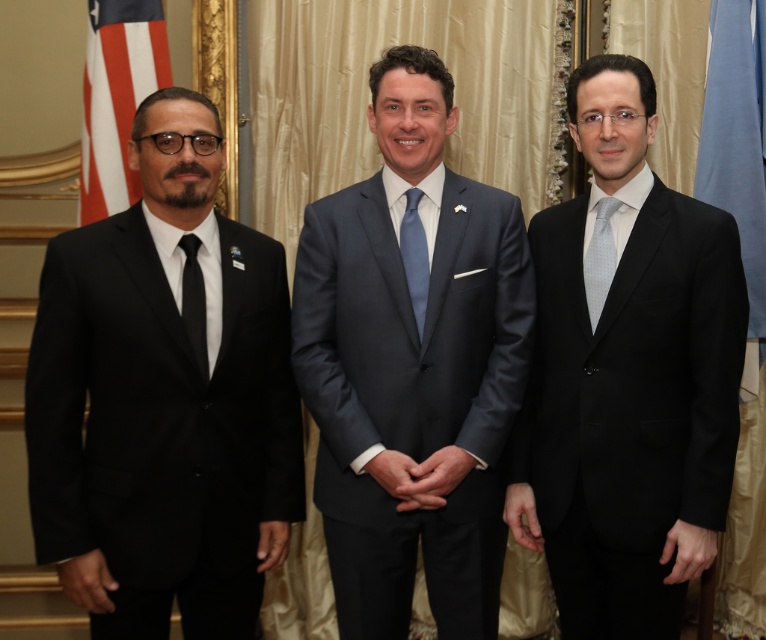
You are a photographer at a diplomatic event. You need to capture a photo where the blue fabric flag at right and the light blue dotted tie at center are exactly 30 inches apart in the frame. Can you position the camera so that their distance in the photo meets this requirement?

The blue fabric flag at right and light blue dotted tie at center are 31.42 inches apart in reality. Since the desired distance in the photo is 30 inches, which is slightly shorter than the actual distance, you can adjust the camera angle or zoom to compress the space between them, making their separation appear closer to the required 30 inches in the frame.

You are standing in front of the three men and want to determine which of the two points, point (755, 216) or point (129, 72), is closer to you. Based on the image, which point is nearer?

Point (755, 216) is closer to the viewer than point (129, 72).

You are attending a diplomatic event and notice two flags displayed behind the men. The flags are the blue fabric flag at right and the american flag at left. Based on their positions and sizes, which flag is narrower?

The blue fabric flag at right has a lesser width compared to the american flag at left, so the blue fabric flag at right is narrower.